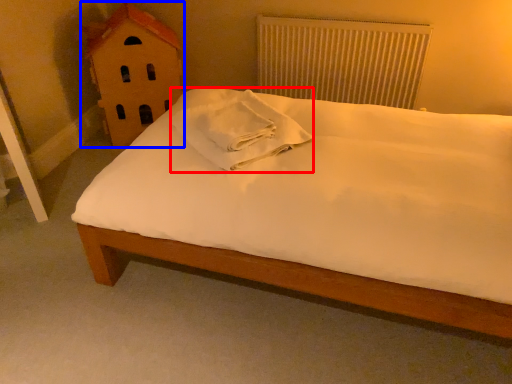
Question: Among these objects, which one is nearest to the camera, material (highlighted by a red box) or toy (highlighted by a blue box)?

Choices:
 (A) material
 (B) toy

Answer: (A)